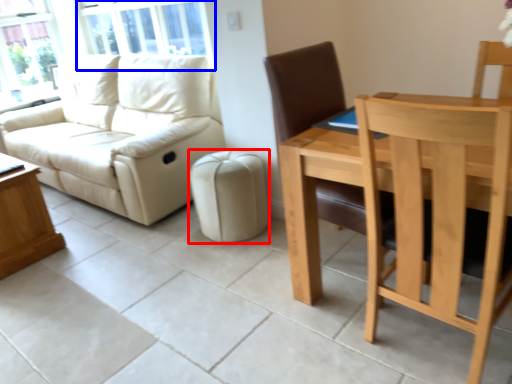
Question: Which object is closer to the camera taking this photo, stool (highlighted by a red box) or window screen (highlighted by a blue box)?

Choices:
 (A) stool
 (B) window screen

Answer: (A)